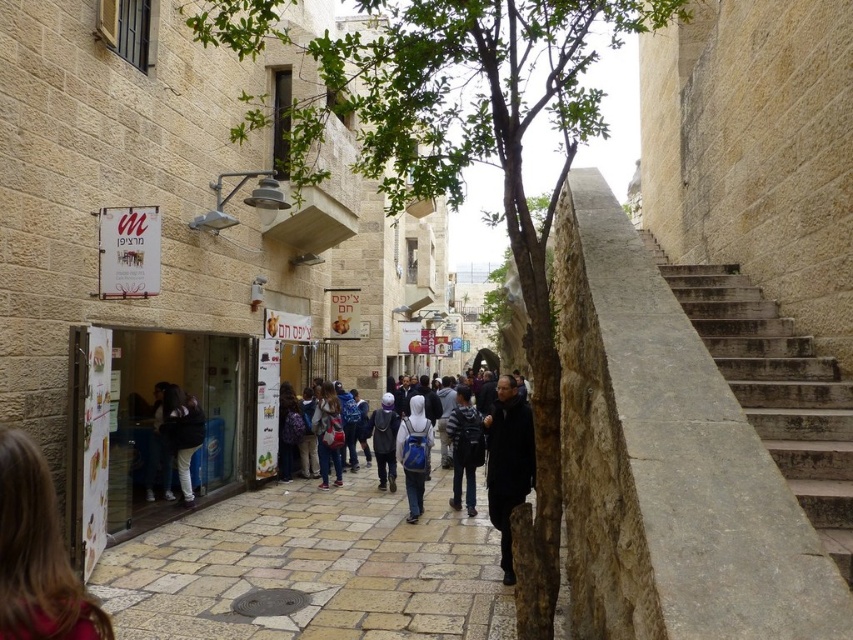
Does striped fabric backpack at center have a larger size compared to dark blue backpack at center?

Yes, striped fabric backpack at center is bigger than dark blue backpack at center.

Is striped fabric backpack at center positioned in front of dark blue backpack at center?

Yes, it is in front of dark blue backpack at center.

Find the location of a particular element. The image size is (853, 640). striped fabric backpack at center is located at coordinates point(463,448).

Is point (41, 541) positioned after point (407, 444)?

No.

Which is behind, point (15, 508) or point (412, 412)?

Positioned behind is point (412, 412).

Who is more distant from viewer, (x=3, y=595) or (x=432, y=433)?

The point (x=432, y=433) is behind.

Where is `blonde hair at lower left`? The image size is (853, 640). blonde hair at lower left is located at coordinates (38, 554).

Which is below, green leafy tree at center or striped fabric backpack at center?

striped fabric backpack at center is below.

Who is more forward, (496, 74) or (451, 456)?

Point (496, 74) is more forward.

Find the location of a particular element. The image size is (853, 640). green leafy tree at center is located at coordinates click(461, 148).

You are a GUI agent. You are given a task and a screenshot of the screen. Output one action in this format:
    pyautogui.click(x=<x>, y=<y>)
    Task: Click on the green leafy tree at center
    This screenshot has width=853, height=640.
    Given the screenshot: What is the action you would take?
    pyautogui.click(x=461, y=148)